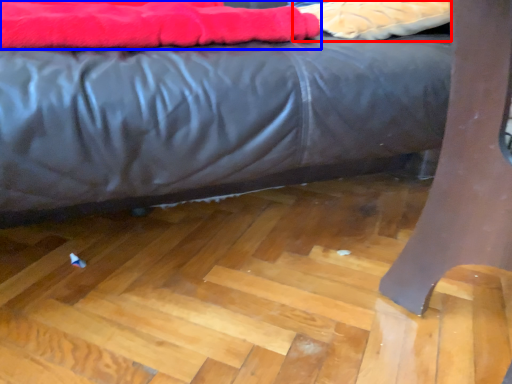
Question: Which point is closer to the camera, material (highlighted by a red box) or blanket (highlighted by a blue box)?

Choices:
 (A) material
 (B) blanket

Answer: (B)